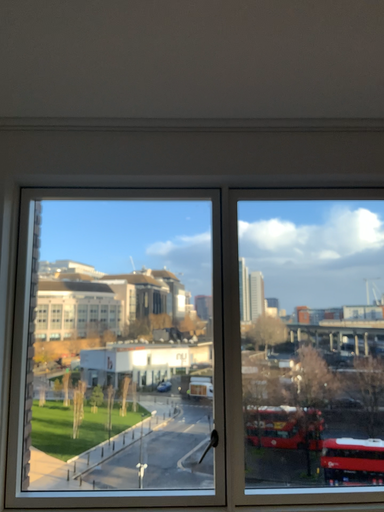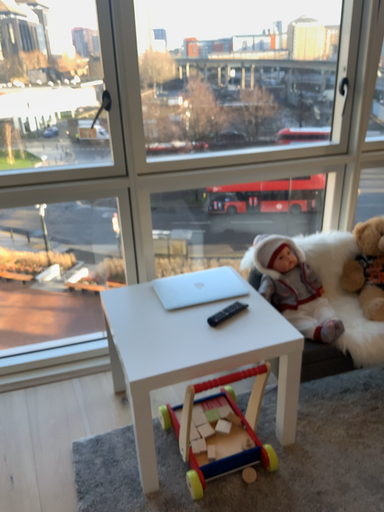
Question: Which way did the camera rotate in the video?

Choices:
 (A) rotated left
 (B) rotated right

Answer: (B)